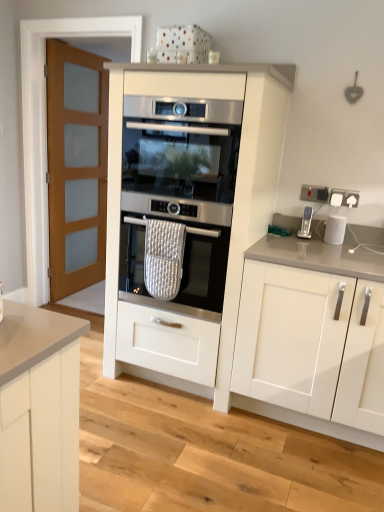
Question: From a real-world perspective, does white matte cabinet at right, the 1th cabinetry in the right-to-left sequence, sit lower than white matte oven at center, the 1th cabinetry when ordered from left to right?

Choices:
 (A) yes
 (B) no

Answer: (A)

Question: Can you confirm if white matte cabinet at right, the 2th cabinetry from the left, is positioned to the right of white matte oven at center, which ranks as the 2th cabinetry in right-to-left order?

Choices:
 (A) no
 (B) yes

Answer: (B)

Question: Is white matte oven at center, which ranks as the 2th cabinetry in right-to-left order, at the back of white matte cabinet at right, the 2th cabinetry from the left?

Choices:
 (A) yes
 (B) no

Answer: (B)

Question: Would you say white matte cabinet at right, the 2th cabinetry from the left, contains white matte oven at center, which ranks as the 2th cabinetry in right-to-left order?

Choices:
 (A) no
 (B) yes

Answer: (A)

Question: Is white matte cabinet at right, the 1th cabinetry in the right-to-left sequence, positioned behind white matte oven at center, the 1th cabinetry when ordered from left to right?

Choices:
 (A) no
 (B) yes

Answer: (A)

Question: In terms of width, does stainless steel oven at center, which is the second oven in bottom-to-top order, look wider or thinner when compared to white matte cabinet at right, the 1th cabinetry in the right-to-left sequence?

Choices:
 (A) thin
 (B) wide

Answer: (A)

Question: Considering the positions of stainless steel oven at center, arranged as the 1th oven when viewed from the top, and white matte cabinet at right, the 2th cabinetry from the left, in the image, is stainless steel oven at center, arranged as the 1th oven when viewed from the top, taller or shorter than white matte cabinet at right, the 2th cabinetry from the left,?

Choices:
 (A) short
 (B) tall

Answer: (A)

Question: Is stainless steel oven at center, which is the second oven in bottom-to-top order, inside the boundaries of white matte cabinet at right, the 1th cabinetry in the right-to-left sequence, or outside?

Choices:
 (A) outside
 (B) inside

Answer: (A)

Question: Is point (196, 188) closer or farther from the camera than point (337, 257)?

Choices:
 (A) farther
 (B) closer

Answer: (B)

Question: In terms of size, does white matte cabinet at right, the 2th cabinetry from the left, appear bigger or smaller than white glossy kettle at upper right?

Choices:
 (A) small
 (B) big

Answer: (B)

Question: In terms of height, does white matte cabinet at right, the 2th cabinetry from the left, look taller or shorter compared to white glossy kettle at upper right?

Choices:
 (A) tall
 (B) short

Answer: (A)

Question: Is white matte cabinet at right, the 1th cabinetry in the right-to-left sequence, inside or outside of white glossy kettle at upper right?

Choices:
 (A) inside
 (B) outside

Answer: (B)

Question: Considering the positions of point click(380, 301) and point click(329, 238), is point click(380, 301) closer or farther from the camera than point click(329, 238)?

Choices:
 (A) closer
 (B) farther

Answer: (A)

Question: Is point (274, 262) closer or farther from the camera than point (130, 229)?

Choices:
 (A) closer
 (B) farther

Answer: (A)

Question: From a real-world perspective, is white matte cabinet at right, the 2th cabinetry from the left, positioned above or below satin silver oven at center, the 1th oven positioned from the bottom?

Choices:
 (A) below
 (B) above

Answer: (A)